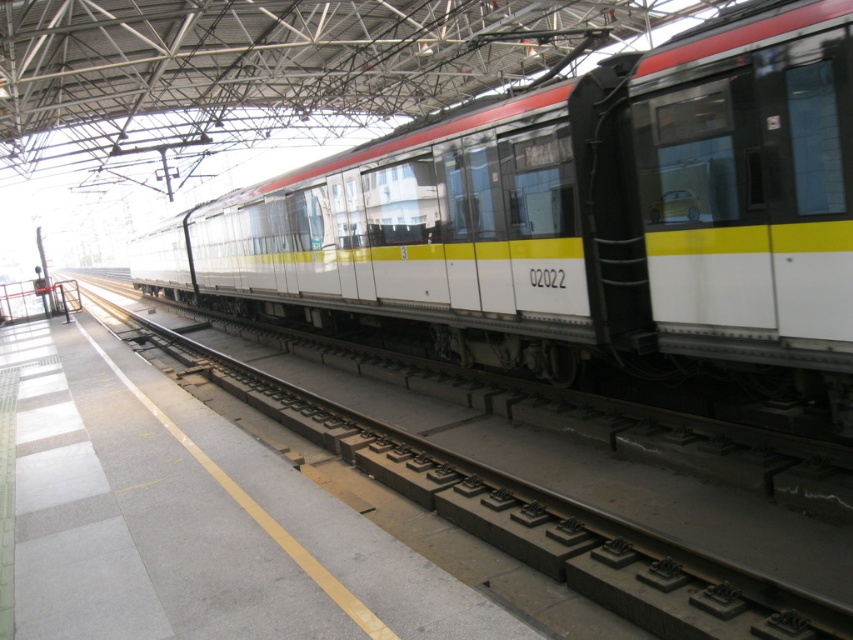
Can you confirm if white glossy train at center is bigger than white glossy track at center?

Yes.

Who is positioned more to the left, white glossy train at center or white glossy track at center?

From the viewer's perspective, white glossy train at center appears more on the left side.

Does point (627, 211) come in front of point (172, 339)?

Yes, it is.

At what (x,y) coordinates should I click in order to perform the action: click on white glossy train at center. Please return your answer as a coordinate pair (x, y). The image size is (853, 640). Looking at the image, I should click on (579, 220).